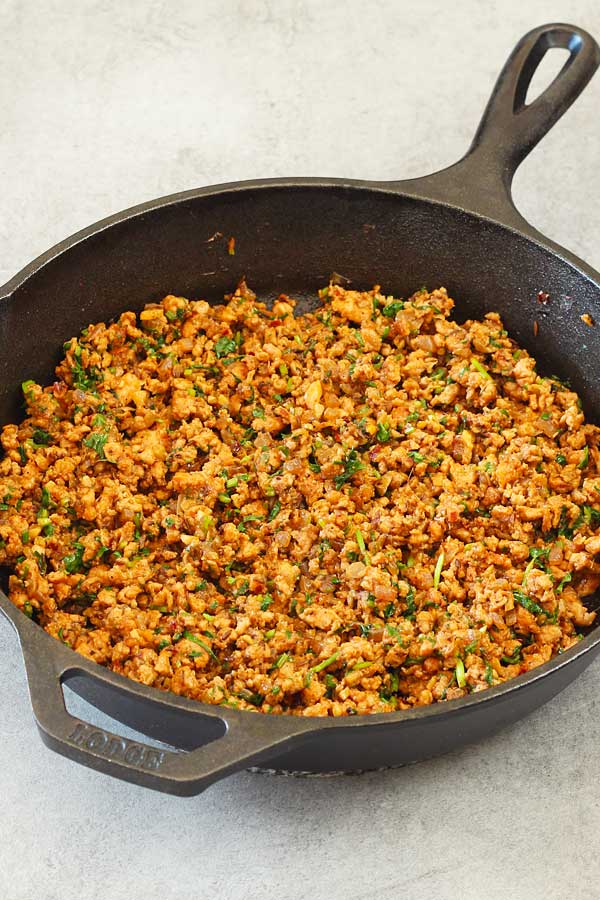
Where is `inside, back of the skillet`? This screenshot has width=600, height=900. inside, back of the skillet is located at coordinates coord(162,262).